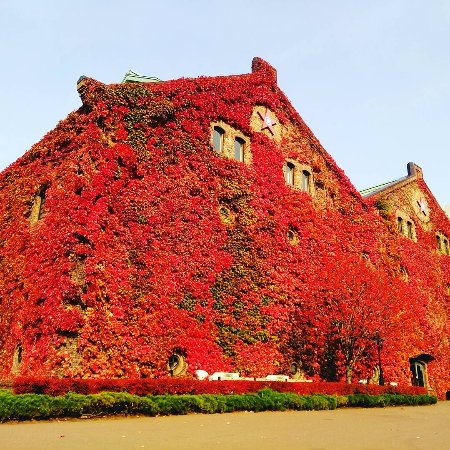
The height and width of the screenshot is (450, 450). Identify the location of canopy over door. (422, 355).